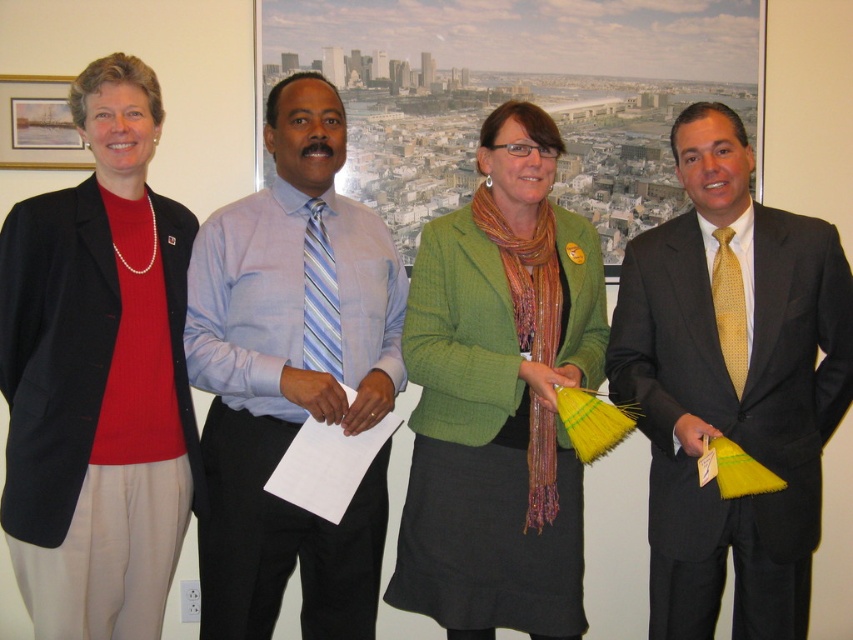
Question: Can you confirm if matte black blazer at left is positioned to the left of yellow dotted tie at center?

Choices:
 (A) yes
 (B) no

Answer: (A)

Question: Which point appears farthest from the camera in this image?

Choices:
 (A) (358, 376)
 (B) (85, 534)
 (C) (831, 394)
 (D) (570, 448)

Answer: (D)

Question: Does blue striped tie at center have a lesser width compared to green textured blazer at center?

Choices:
 (A) yes
 (B) no

Answer: (A)

Question: Is yellow dotted tie at center bigger than wooden frame at upper left?

Choices:
 (A) no
 (B) yes

Answer: (B)

Question: Estimate the real-world distances between objects in this image. Which object is farther from the yellow dotted tie at center?

Choices:
 (A) blue striped tie at center
 (B) wooden frame at upper left

Answer: (B)

Question: Which point appears closest to the camera in this image?

Choices:
 (A) (190, 442)
 (B) (0, 145)
 (C) (276, 268)

Answer: (A)